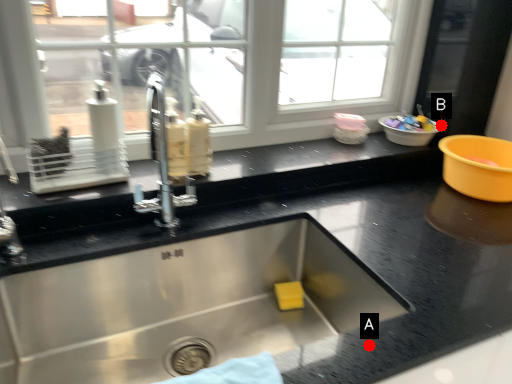
Question: Two points are circled on the image, labeled by A and B beside each circle. Which point is farther from the camera taking this photo?

Choices:
 (A) A is further
 (B) B is further

Answer: (B)